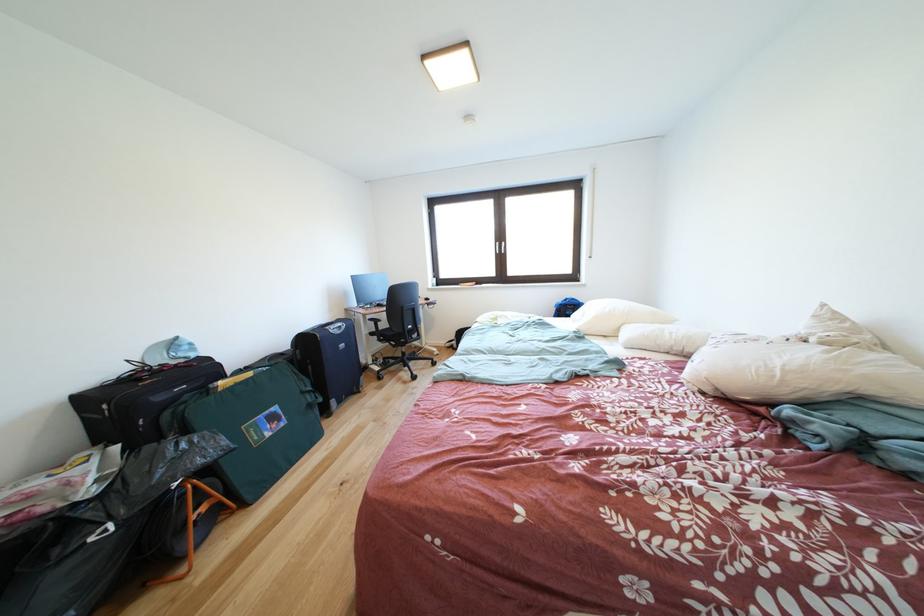
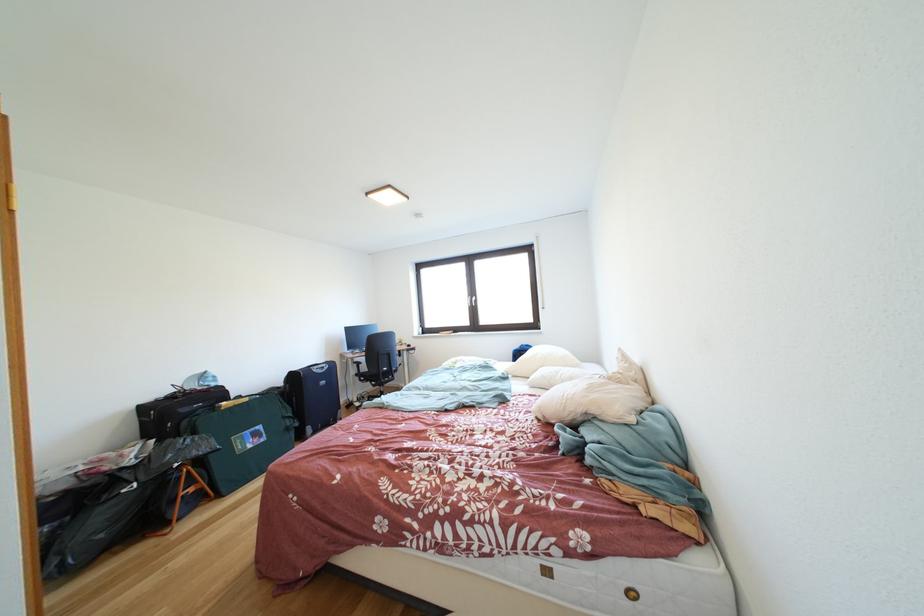
Which direction would the cameraman need to move to produce the second image?

The cameraman moved toward right, backward.